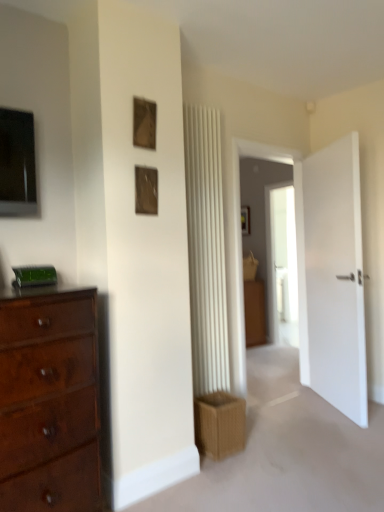
Question: In the image, is wooden frame at upper center, which is counted as the 2th picture frame, starting from the bottom, on the left side or the right side of brown cardboard crate at lower center?

Choices:
 (A) right
 (B) left

Answer: (B)

Question: From their relative heights in the image, would you say wooden frame at upper center, which is counted as the 2th picture frame, starting from the bottom, is taller or shorter than brown cardboard crate at lower center?

Choices:
 (A) tall
 (B) short

Answer: (B)

Question: Based on their relative distances, which object is farther from the wooden frame at upper center, which is counted as the 2th picture frame, starting from the bottom?

Choices:
 (A) brown cardboard crate at lower center
 (B) mahogany wood dresser at left
 (C) wooden picture frame at upper center, which is the first picture frame in bottom-to-top order

Answer: (A)

Question: Based on their relative distances, which object is nearer to the wooden picture frame at upper center, which is the second picture frame from top to bottom?

Choices:
 (A) wooden frame at upper center, which is counted as the 2th picture frame, starting from the bottom
 (B) mahogany wood dresser at left
 (C) brown cardboard crate at lower center

Answer: (A)